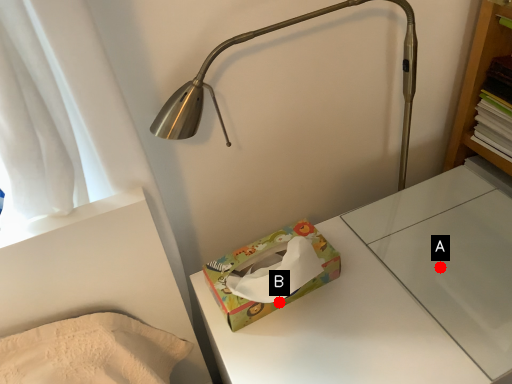
Question: Two points are circled on the image, labeled by A and B beside each circle. Which point appears farthest from the camera in this image?

Choices:
 (A) A is further
 (B) B is further

Answer: (A)